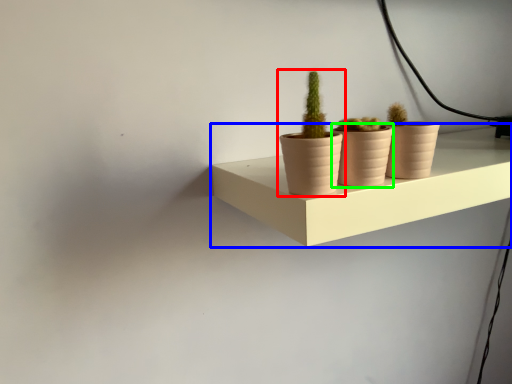
Question: Based on their relative distances, which object is farther from houseplant (highlighted by a red box)? Choose from shelf (highlighted by a blue box) and flowerpot (highlighted by a green box).

Choices:
 (A) shelf
 (B) flowerpot

Answer: (A)